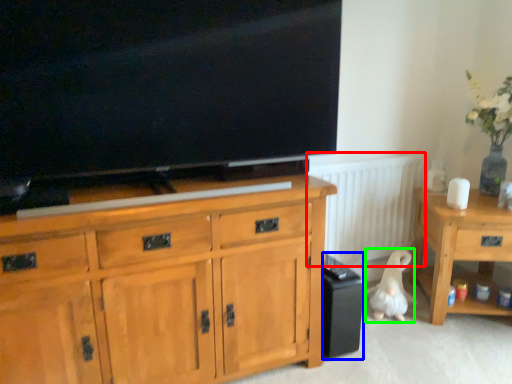
Question: Based on their relative distances, which object is farther from radiator (highlighted by a red box)? Choose from loudspeaker (highlighted by a blue box) and animal (highlighted by a green box).

Choices:
 (A) loudspeaker
 (B) animal

Answer: (A)